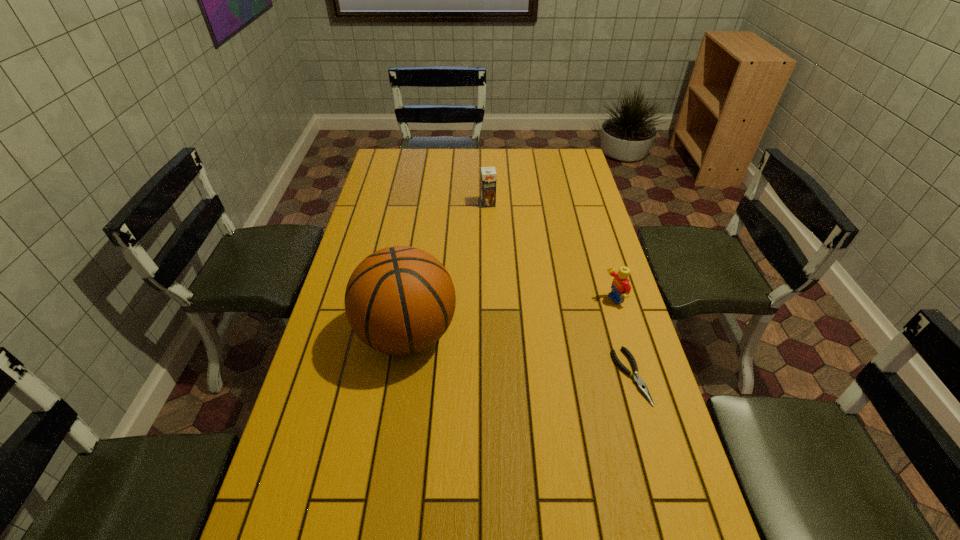
Where is `free space between the farthest object and the tallest object`? free space between the farthest object and the tallest object is located at coordinates (447, 268).

In order to click on unoccupied area between the shortest object and the third tallest object in this screenshot , I will do `click(622, 338)`.

The height and width of the screenshot is (540, 960). Find the location of `object that stands as the second closest to the Lego`. object that stands as the second closest to the Lego is located at coordinates (400, 300).

Identify the location of object that is the second closest to the second shortest object. This screenshot has width=960, height=540. (400, 300).

Locate an element on the screen. The image size is (960, 540). free space that satisfies the following two spatial constraints: 1. on the front side of the leftmost object; 2. on the left side of the pliers is located at coordinates (400, 376).

Where is `free point that satisfies the following two spatial constraints: 1. on the front side of the third tallest object; 2. on the left side of the farthest object`? free point that satisfies the following two spatial constraints: 1. on the front side of the third tallest object; 2. on the left side of the farthest object is located at coordinates (491, 300).

Image resolution: width=960 pixels, height=540 pixels. I want to click on vacant space that satisfies the following two spatial constraints: 1. on the back side of the basketball; 2. on the right side of the chocolate milk, so click(426, 204).

The image size is (960, 540). What are the coordinates of `blank area in the image that satisfies the following two spatial constraints: 1. on the back side of the third tallest object; 2. on the left side of the tallest object` in the screenshot? It's located at (412, 300).

Find the location of `blank area in the image that satisfies the following two spatial constraints: 1. on the front side of the shortest object; 2. on the left side of the third shortest object`. blank area in the image that satisfies the following two spatial constraints: 1. on the front side of the shortest object; 2. on the left side of the third shortest object is located at coordinates (492, 376).